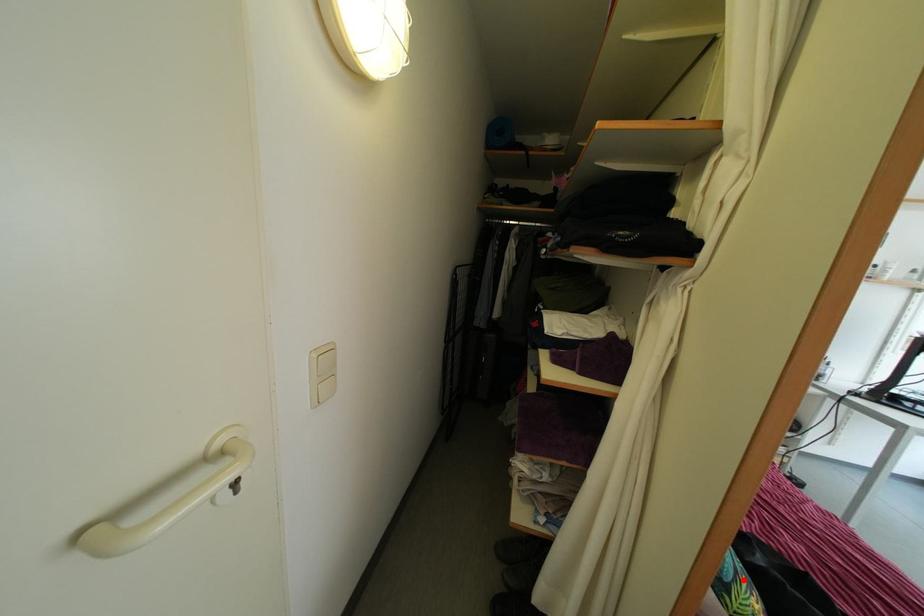
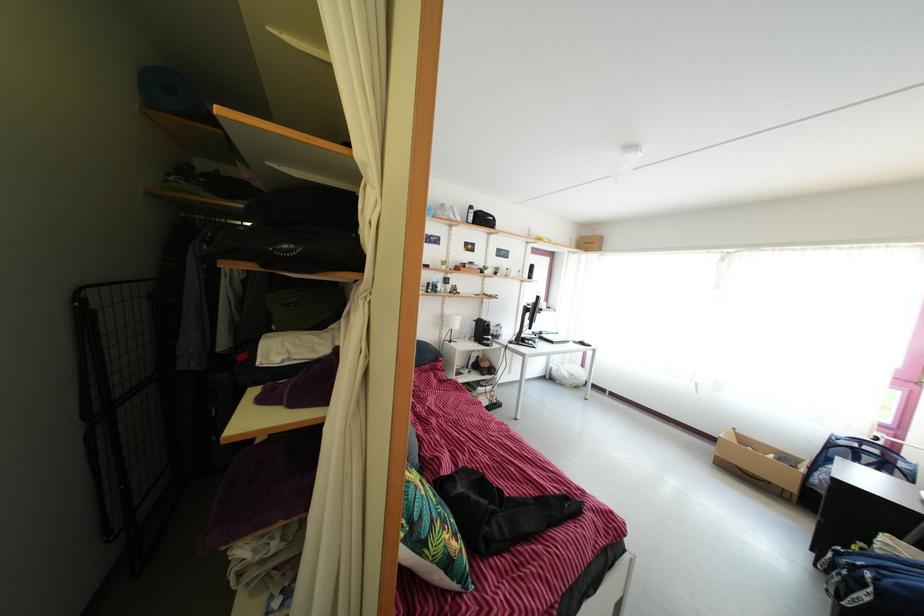
Where in the second image is the point corresponding to the highlighted location from the first image?

(439, 531)